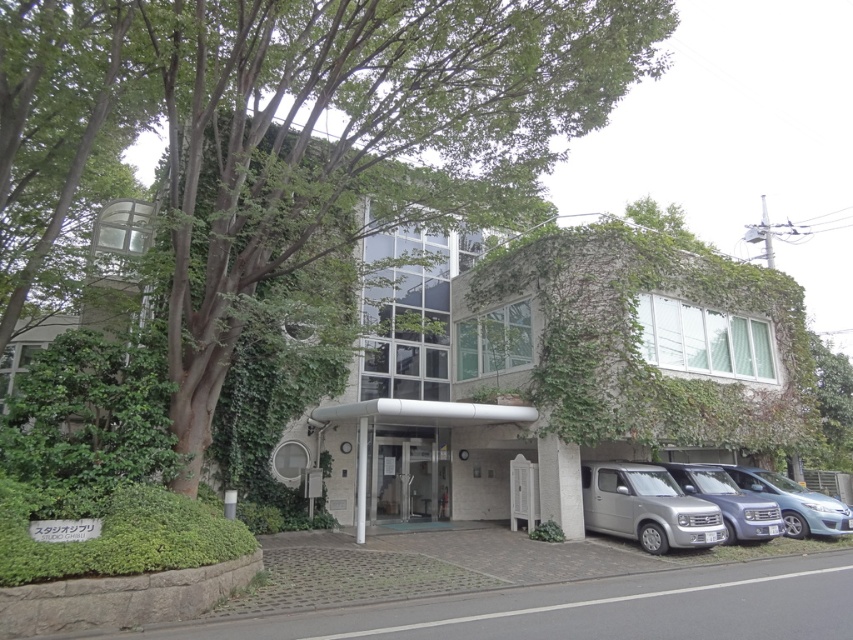
Question: Is metallic silver van at lower right closer to the viewer compared to satin blue van at lower right?

Choices:
 (A) yes
 (B) no

Answer: (A)

Question: Which point is farther from the camera taking this photo?

Choices:
 (A) (787, 524)
 (B) (762, 504)
 (C) (631, 483)
 (D) (498, 204)

Answer: (A)

Question: Estimate the real-world distances between objects in this image. Which object is closer to the metallic silver van at lower right?

Choices:
 (A) silver metallic van at lower right
 (B) satin blue van at lower right

Answer: (B)

Question: Based on their relative distances, which object is nearer to the satin blue van at lower right?

Choices:
 (A) green leafy tree at center
 (B) metallic silver van at lower right
 (C) silver metallic van at lower right

Answer: (B)

Question: Is green leafy tree at center closer to camera compared to metallic silver van at lower right?

Choices:
 (A) no
 (B) yes

Answer: (B)

Question: Is the position of silver metallic van at lower right more distant than that of metallic silver van at lower right?

Choices:
 (A) yes
 (B) no

Answer: (B)